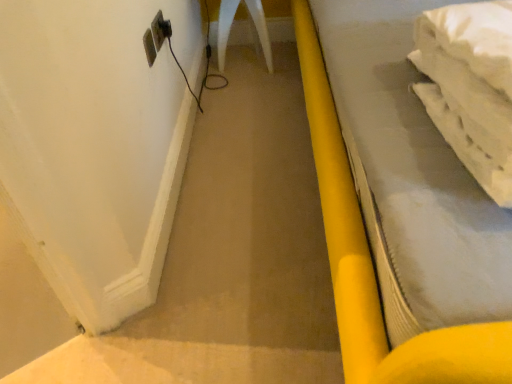
Question: Can you confirm if yellow plastic bed at right is thinner than white plastic electric outlet at upper left?

Choices:
 (A) no
 (B) yes

Answer: (A)

Question: From the image's perspective, would you say yellow plastic bed at right is positioned over white plastic electric outlet at upper left?

Choices:
 (A) yes
 (B) no

Answer: (B)

Question: From the image's perspective, is yellow plastic bed at right beneath white plastic electric outlet at upper left?

Choices:
 (A) yes
 (B) no

Answer: (A)

Question: From a real-world perspective, does yellow plastic bed at right sit lower than white plastic electric outlet at upper left?

Choices:
 (A) yes
 (B) no

Answer: (A)

Question: Can you confirm if yellow plastic bed at right is smaller than white plastic electric outlet at upper left?

Choices:
 (A) no
 (B) yes

Answer: (A)

Question: From a real-world perspective, relative to yellow plastic bed at right, is black plastic plug at upper left vertically above or below?

Choices:
 (A) below
 (B) above

Answer: (B)

Question: From the image's perspective, is black plastic plug at upper left located above or below yellow plastic bed at right?

Choices:
 (A) below
 (B) above

Answer: (B)

Question: Considering the positions of black plastic plug at upper left and yellow plastic bed at right in the image, is black plastic plug at upper left bigger or smaller than yellow plastic bed at right?

Choices:
 (A) big
 (B) small

Answer: (B)

Question: Is black plastic plug at upper left in front of or behind yellow plastic bed at right in the image?

Choices:
 (A) behind
 (B) front

Answer: (A)

Question: Is point (352, 326) closer or farther from the camera than point (160, 39)?

Choices:
 (A) farther
 (B) closer

Answer: (B)

Question: In the image, is yellow plastic bed at right on the left side or the right side of white plastic electric outlet at upper left?

Choices:
 (A) right
 (B) left

Answer: (A)

Question: In terms of size, does yellow plastic bed at right appear bigger or smaller than white plastic electric outlet at upper left?

Choices:
 (A) big
 (B) small

Answer: (A)

Question: Is yellow plastic bed at right spatially inside white plastic electric outlet at upper left, or outside of it?

Choices:
 (A) outside
 (B) inside

Answer: (A)

Question: Does point (159, 38) appear closer or farther from the camera than point (167, 34)?

Choices:
 (A) farther
 (B) closer

Answer: (B)

Question: Considering the positions of white plastic electric outlet at upper left and black plastic plug at upper left in the image, is white plastic electric outlet at upper left taller or shorter than black plastic plug at upper left?

Choices:
 (A) tall
 (B) short

Answer: (A)